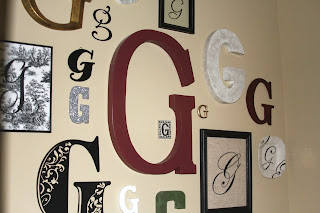
This screenshot has width=320, height=213. I want to click on right wall, so click(x=305, y=36).